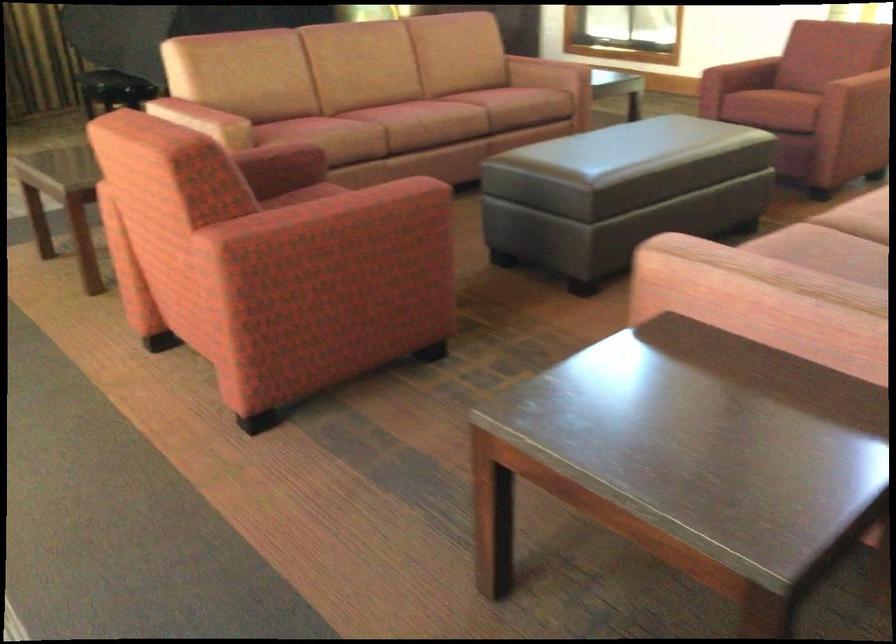
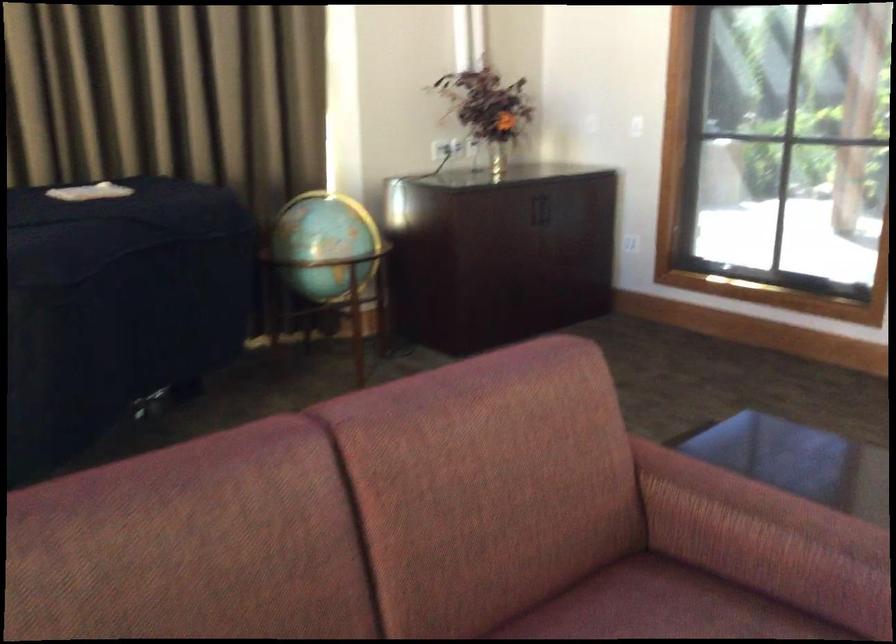
Question: Which direction would the cameraman need to move to produce the second image? Reply with the corresponding letter.

Choices:
 (A) Left
 (B) Right
 (C) Forward
 (D) Backward

Answer: (C)